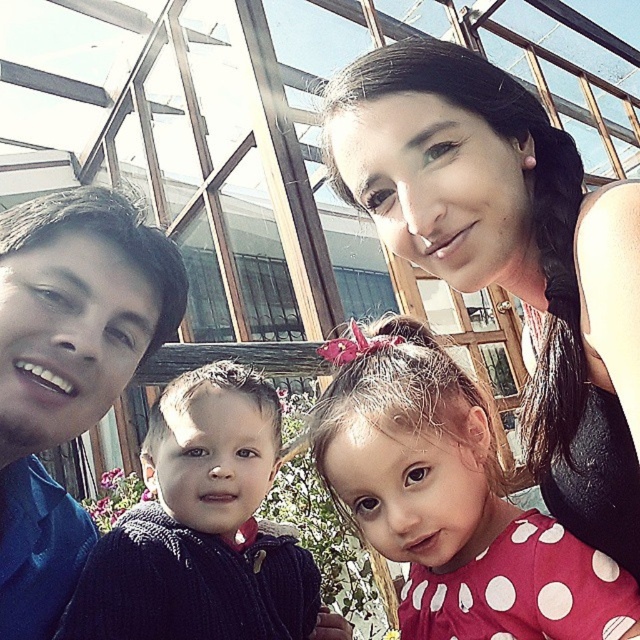
Question: Can you confirm if white polka dot dress at center is smaller than dark blue corduroy sweater at left?

Choices:
 (A) no
 (B) yes

Answer: (A)

Question: Can you confirm if matte black hair at upper center is wider than white polka dot dress at center?

Choices:
 (A) yes
 (B) no

Answer: (B)

Question: Which point is farther to the camera?

Choices:
 (A) white polka dot dress at center
 (B) dark blue corduroy sweater at left
 (C) matte black hair at upper center
 (D) blue shirt at left

Answer: (B)

Question: Based on their relative distances, which object is farther from the dark blue corduroy sweater at left?

Choices:
 (A) blue shirt at left
 (B) matte black hair at upper center
 (C) white polka dot dress at center

Answer: (B)

Question: Which object appears closest to the camera in this image?

Choices:
 (A) matte black hair at upper center
 (B) dark blue corduroy sweater at left
 (C) blue shirt at left
 (D) white polka dot dress at center

Answer: (A)

Question: Does matte black hair at upper center have a greater width compared to dark blue corduroy sweater at left?

Choices:
 (A) no
 (B) yes

Answer: (A)